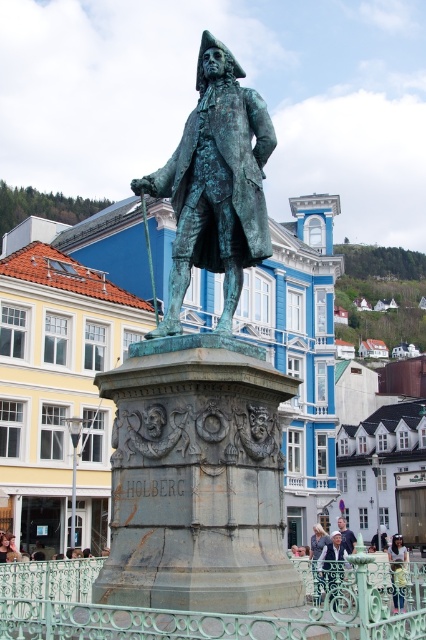
You are standing in the public square and want to take a photo of the green patina statue at center. If you are at the origin point, which is the coordinate of the statue?

The green patina statue at center is located at coordinate point (203, 387).

You are an artist trying to sketch the statue in the plaza. You notice two elements at the center of the image. Which one is wider, the light brown leather jacket at center or the light brown wood man at center?

The light brown leather jacket at center is wider than the light brown wood man at center according to the description.